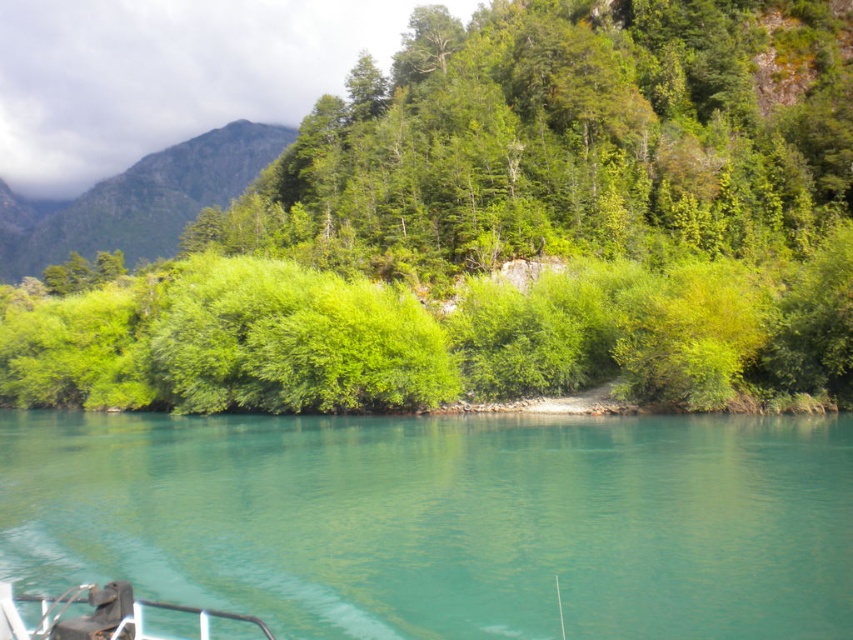
You are a hiker standing at the green leafy shrub at center and want to reach the green leafy hillside at upper left. Can you walk directly to the hillside without crossing any obstacles?

The distance between the green leafy shrub at center and the green leafy hillside at upper left is 186.47 meters. Since there are no mentioned obstacles in the scene description, you can walk directly to the hillside.

You are standing on the edge of the green water at center and want to climb up to the green leafy hillside at upper left. Based on the scene, which direction should you head to reach the hillside?

To reach the green leafy hillside at upper left from the green water at center, you should head upward since the green water at center is located below the green leafy hillside at upper left.

You are standing at the edge of the water in the serene landscape. You see two points marked in the scene. Which point is closer to you, point [669,100] or point [26,444]?

Point [26,444] is closer to you because it is less further to the camera than point [669,100].